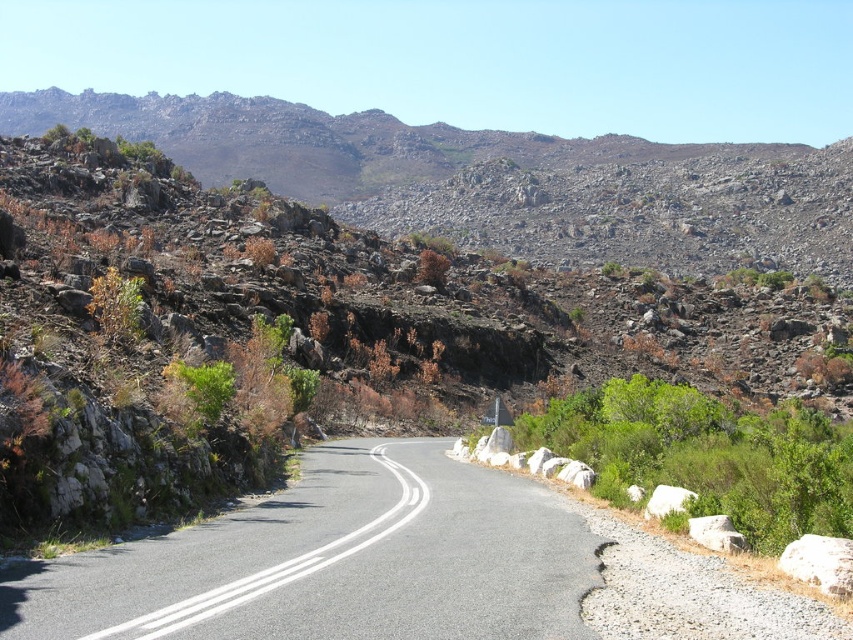
Question: Which point appears farthest from the camera in this image?

Choices:
 (A) (352, 147)
 (B) (693, 518)

Answer: (A)

Question: Can you confirm if asphalt road at center is positioned to the left of white rock at right?

Choices:
 (A) no
 (B) yes

Answer: (B)

Question: Which object is the farthest from the gray rough rock at right?

Choices:
 (A) white rock at right
 (B) asphalt road at center
 (C) white rock at lower right
 (D) rugged rock mountain at upper center

Answer: (D)

Question: Where is white rock at lower right located in relation to white rock at right in the image?

Choices:
 (A) left
 (B) right

Answer: (B)

Question: Which object is farther from the camera taking this photo?

Choices:
 (A) asphalt road at center
 (B) white rock at lower right
 (C) rugged rock mountain at upper center

Answer: (C)

Question: Does asphalt road at center appear under gray rough rock at right?

Choices:
 (A) yes
 (B) no

Answer: (A)